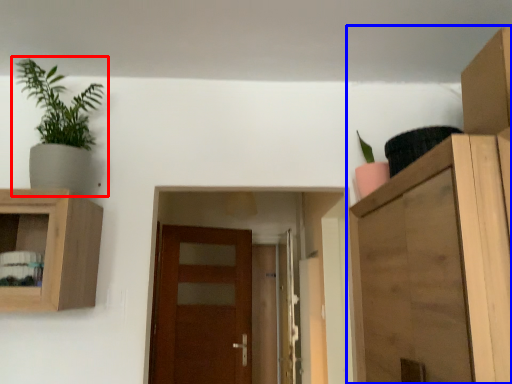
Question: Which of the following is the farthest to the observer, houseplant (highlighted by a red box) or cupboard (highlighted by a blue box)?

Choices:
 (A) houseplant
 (B) cupboard

Answer: (A)